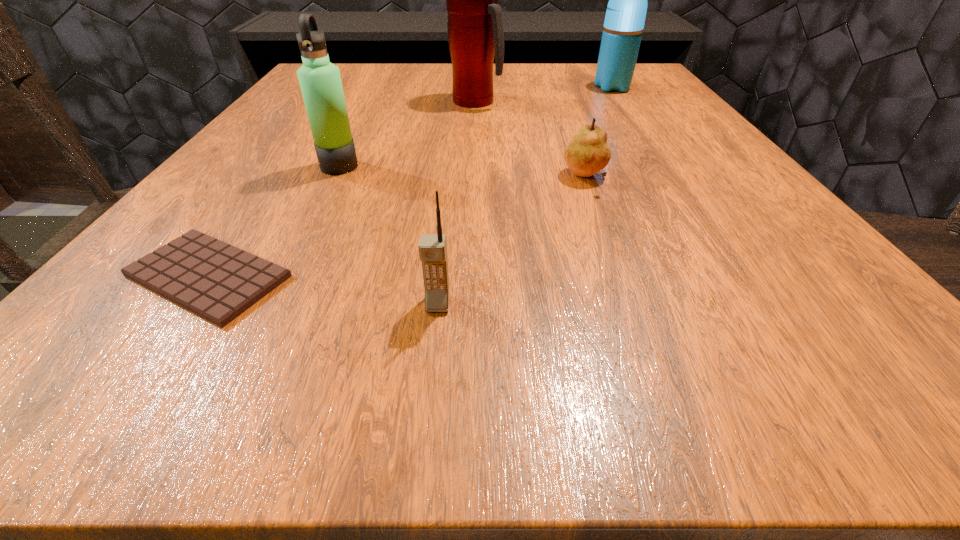
This screenshot has width=960, height=540. In order to click on free space between the second thermos bottle from right to left and the third shortest object in this screenshot , I will do click(457, 203).

This screenshot has height=540, width=960. Identify the location of blank region between the shortest object and the cellular telephone. (323, 290).

Locate an element on the screen. The image size is (960, 540). empty location between the nearest thermos bottle and the shortest object is located at coordinates (274, 221).

At what (x,y) coordinates should I click in order to perform the action: click on unoccupied position between the chocolate bar and the leftmost thermos bottle. Please return your answer as a coordinate pair (x, y). The image size is (960, 540). Looking at the image, I should click on (274, 221).

Select which object appears as the second closest to the second thermos bottle from right to left. Please provide its 2D coordinates. Your answer should be formatted as a tuple, i.e. [(x, y)], where the tuple contains the x and y coordinates of a point satisfying the conditions above.

[(588, 153)]

Where is `object that can be found as the third closest to the nearest thermos bottle`? This screenshot has width=960, height=540. object that can be found as the third closest to the nearest thermos bottle is located at coordinates (432, 247).

Identify the location of thermos bottle that is the second closest to the fifth tallest object. The image size is (960, 540). (320, 81).

This screenshot has width=960, height=540. In order to click on thermos bottle that is the closest to the second thermos bottle from left to right in this screenshot , I will do `click(625, 16)`.

I want to click on free space that satisfies the following two spatial constraints: 1. on the back side of the rightmost thermos bottle; 2. on the right side of the pear, so click(552, 87).

The height and width of the screenshot is (540, 960). I want to click on free location that satisfies the following two spatial constraints: 1. on the back side of the rightmost thermos bottle; 2. on the right side of the shortest object, so click(x=342, y=87).